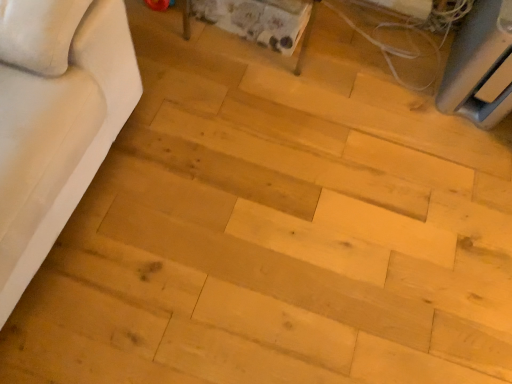
At what (x,y) coordinates should I click in order to perform the action: click on vacant space positioned to the left of matte gray table at upper right. Please return your answer as a coordinate pair (x, y). Looking at the image, I should click on (390, 62).